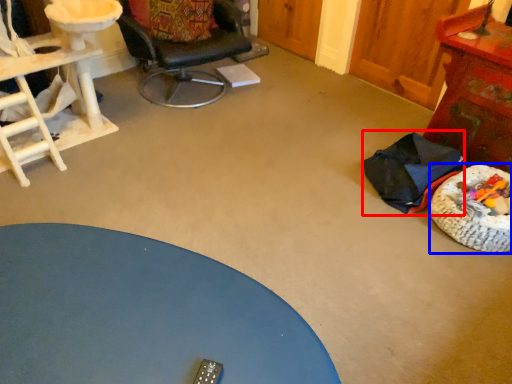
Question: Which object is further to the camera taking this photo, chair (highlighted by a red box) or dog bed (highlighted by a blue box)?

Choices:
 (A) chair
 (B) dog bed

Answer: (A)